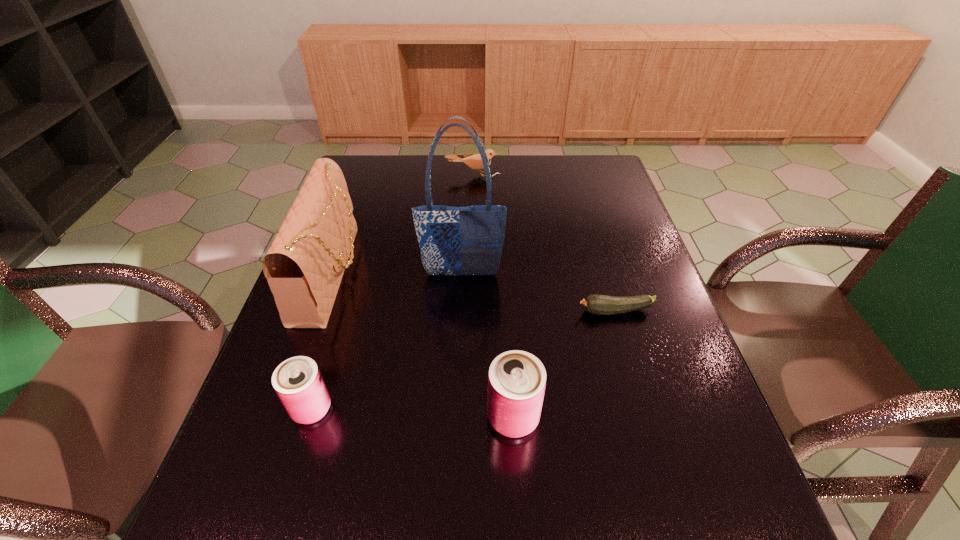
The image size is (960, 540). I want to click on vacant spot to place a can on the right, so click(x=721, y=426).